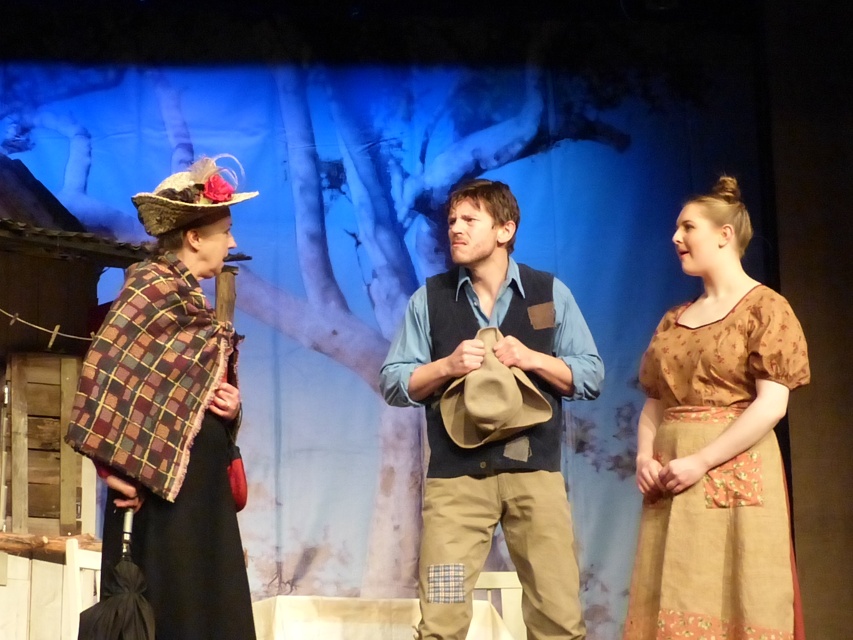
Describe the element at coordinates (172, 416) in the screenshot. The height and width of the screenshot is (640, 853). I see `plaid fabric shawl at left` at that location.

Locate an element on the screen. This screenshot has width=853, height=640. plaid fabric shawl at left is located at coordinates (172, 416).

Consider the image. Is floral cotton dress at right smaller than denim vest at center?

Yes, floral cotton dress at right is smaller than denim vest at center.

Looking at this image, does floral cotton dress at right come behind denim vest at center?

That is False.

Is point (732, 602) in front of point (438, 515)?

Yes.

In order to click on floral cotton dress at right in this screenshot , I will do `click(717, 445)`.

The width and height of the screenshot is (853, 640). What do you see at coordinates (717, 445) in the screenshot?
I see `floral cotton dress at right` at bounding box center [717, 445].

Between point (677, 560) and point (206, 454), which one is positioned behind?

The point (677, 560) is more distant.

Between point (643, 604) and point (137, 202), which one is positioned behind?

The point (643, 604) is more distant.

The image size is (853, 640). In order to click on floral cotton dress at right in this screenshot , I will do `click(717, 445)`.